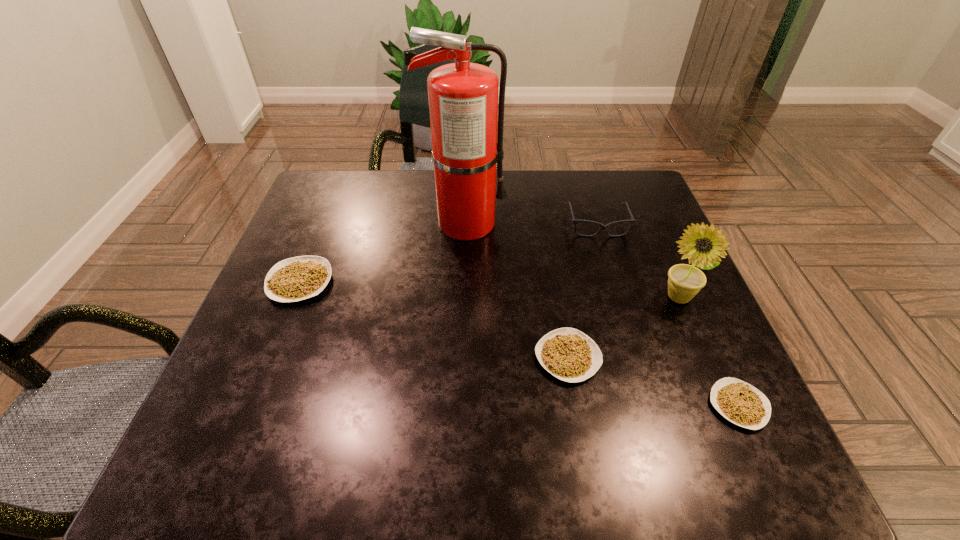
Please point a location where one more legume can be added evenly. Please provide its 2D coordinates. Your answer should be formatted as a tuple, i.e. [(x, y)], where the tuple contains the x and y coordinates of a point satisfying the conditions above.

[(423, 316)]